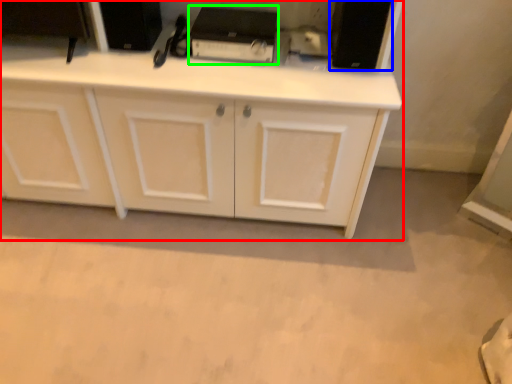
Question: Based on their relative distances, which object is nearer to cabinetry (highlighted by a red box)? Choose from appliance (highlighted by a blue box) and appliance (highlighted by a green box).

Choices:
 (A) appliance
 (B) appliance

Answer: (B)